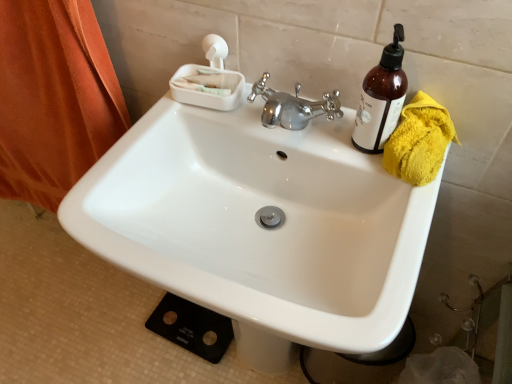
This screenshot has height=384, width=512. Find the location of `vacant area situated to the left side of orange fabric at left`. vacant area situated to the left side of orange fabric at left is located at coordinates (29, 252).